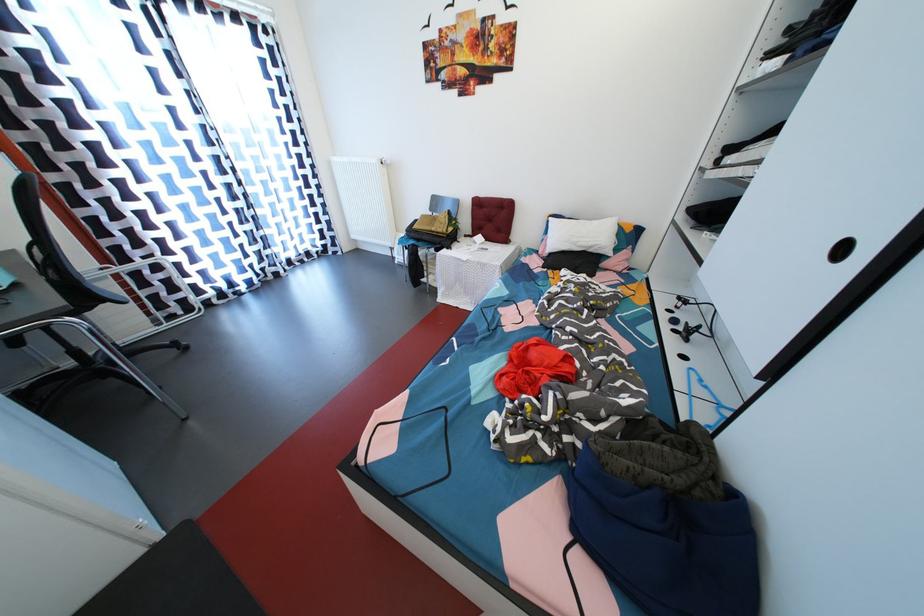
Find the location of a particular element. white bed pillow is located at coordinates (580, 235).